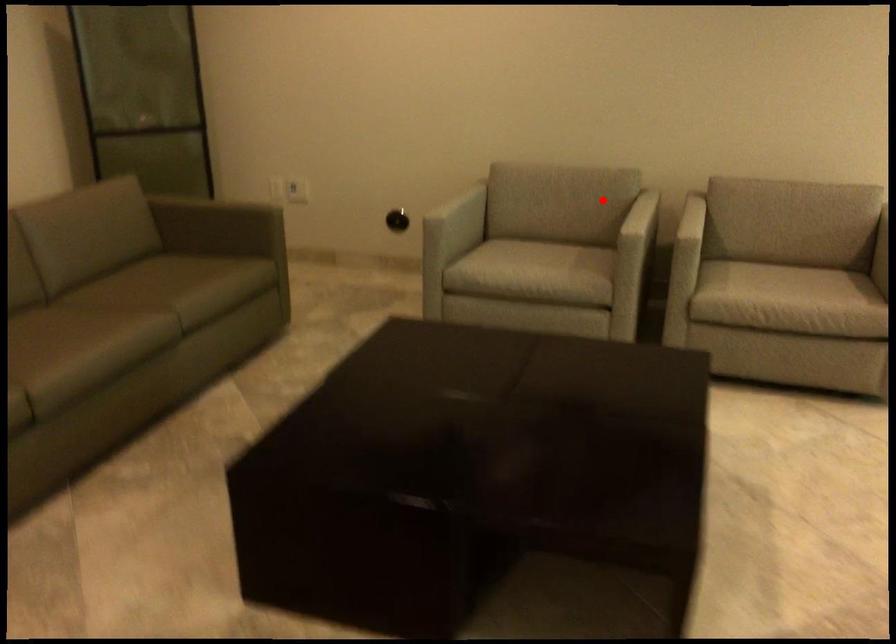
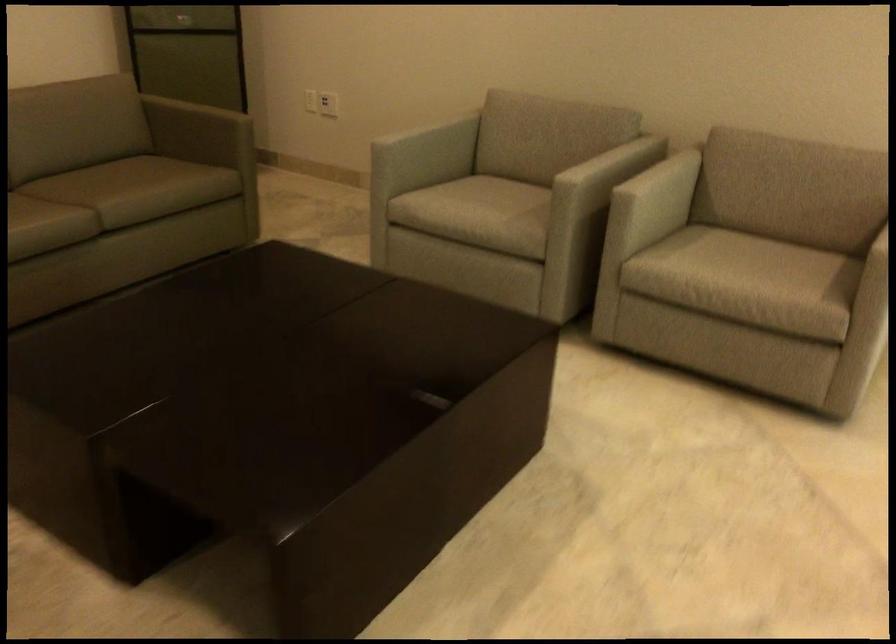
Find the pixel in the second image that matches the highlighted location in the first image.

(588, 149)